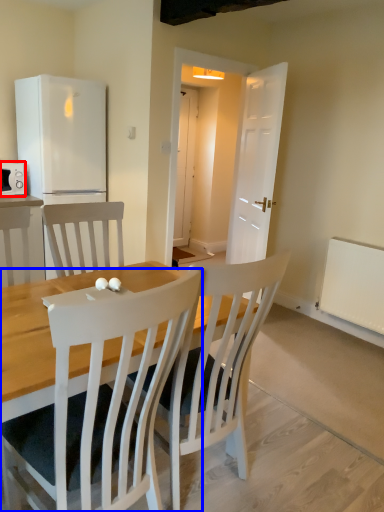
Question: Which object is closer to the camera taking this photo, microwave oven (highlighted by a red box) or chair (highlighted by a blue box)?

Choices:
 (A) microwave oven
 (B) chair

Answer: (B)